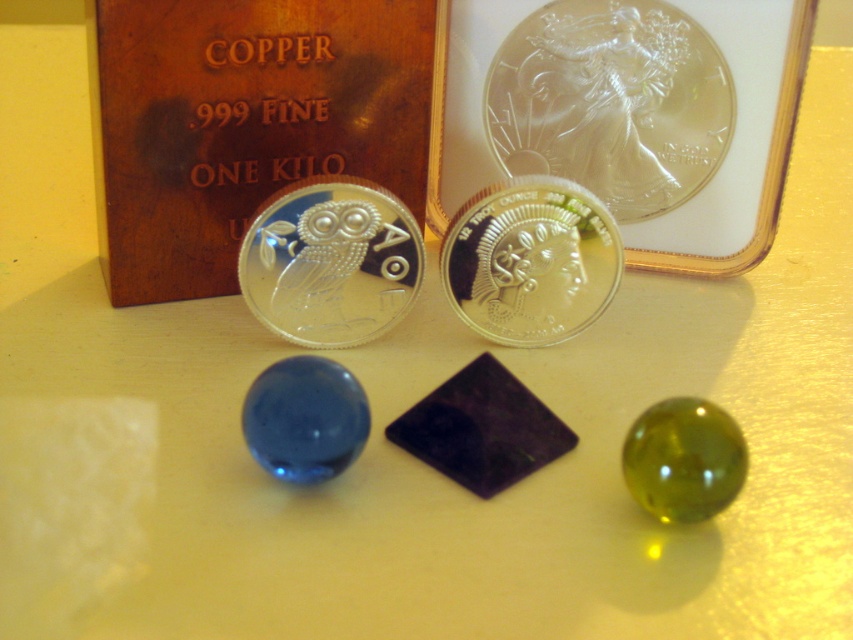
Based on the photo, which of these two, satin silver coin at center or silver/glossy coin at center, stands taller?

silver/glossy coin at center

Which is more to the left, satin silver coin at center or silver/glossy coin at center?

Positioned to the left is satin silver coin at center.

Between point (386, 198) and point (531, 234), which one is positioned in front?

Point (386, 198) is more forward.

In order to click on satin silver coin at center in this screenshot , I will do pyautogui.click(x=331, y=262).

Does point (538, 56) lie in front of point (392, 211)?

No, it is behind (392, 211).

Can you confirm if clear glass coin at upper center is smaller than satin silver coin at center?

No.

I want to click on clear glass coin at upper center, so point(611,100).

Where is `clear glass coin at upper center`? clear glass coin at upper center is located at coordinates pos(611,100).

Who is lower down, clear glass coin at upper center or silver/glossy coin at center?

Positioned lower is silver/glossy coin at center.

Who is taller, clear glass coin at upper center or silver/glossy coin at center?

Standing taller between the two is clear glass coin at upper center.

Is point (693, 76) less distant than point (463, 248)?

No, (693, 76) is behind (463, 248).

Image resolution: width=853 pixels, height=640 pixels. Find the location of `clear glass coin at upper center`. clear glass coin at upper center is located at coordinates (611, 100).